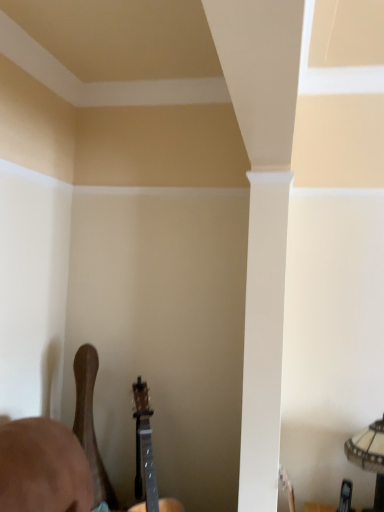
The width and height of the screenshot is (384, 512). What do you see at coordinates (370, 457) in the screenshot?
I see `glass textured lampshade at lower right` at bounding box center [370, 457].

You are a GUI agent. You are given a task and a screenshot of the screen. Output one action in this format:
    pyautogui.click(x=<x>, y=<y>)
    Task: Click on the wooden acoustic guitar at lower center, acting as the first guitar starting from the right
    
    Given the screenshot: What is the action you would take?
    pyautogui.click(x=147, y=457)

Identify the location of glass textured lampshade at lower right. Image resolution: width=384 pixels, height=512 pixels. (370, 457).

How distant is glass textured lampshade at lower right from wooden acoustic guitar at lower left, the 1th guitar when ordered from left to right?

glass textured lampshade at lower right is 4.02 feet away from wooden acoustic guitar at lower left, the 1th guitar when ordered from left to right.

Can you tell me how much glass textured lampshade at lower right and wooden acoustic guitar at lower left, arranged as the second guitar when viewed from the right, differ in facing direction?

The facing directions of glass textured lampshade at lower right and wooden acoustic guitar at lower left, arranged as the second guitar when viewed from the right, are 90.4 degrees apart.

Which of these two, glass textured lampshade at lower right or wooden acoustic guitar at lower left, arranged as the second guitar when viewed from the right, is smaller?

glass textured lampshade at lower right.

In terms of height, does glass textured lampshade at lower right look taller or shorter compared to wooden acoustic guitar at lower left, the 1th guitar when ordered from left to right?

Clearly, glass textured lampshade at lower right is shorter compared to wooden acoustic guitar at lower left, the 1th guitar when ordered from left to right.

Is wooden acoustic guitar at lower left, the 1th guitar when ordered from left to right, oriented towards wooden acoustic guitar at lower center, which is the 2th guitar from left to right?

Yes, wooden acoustic guitar at lower left, the 1th guitar when ordered from left to right, is turned towards wooden acoustic guitar at lower center, which is the 2th guitar from left to right.

Between wooden acoustic guitar at lower left, the 1th guitar when ordered from left to right, and wooden acoustic guitar at lower center, which is the 2th guitar from left to right, which one is positioned behind?

wooden acoustic guitar at lower left, the 1th guitar when ordered from left to right, is further away from the camera.

Between point (102, 501) and point (144, 506), which one is positioned behind?

The point (144, 506) is behind.

From the image's perspective, between wooden acoustic guitar at lower left, arranged as the second guitar when viewed from the right, and wooden acoustic guitar at lower center, which is the 2th guitar from left to right, who is located below?

wooden acoustic guitar at lower center, which is the 2th guitar from left to right.

Locate an element on the screen. The height and width of the screenshot is (512, 384). lamp in front of the wooden acoustic guitar at lower left, the 1th guitar when ordered from left to right is located at coordinates (370, 457).

From the image's perspective, is wooden acoustic guitar at lower left, arranged as the second guitar when viewed from the right, on top of glass textured lampshade at lower right?

Yes, from the image's perspective, wooden acoustic guitar at lower left, arranged as the second guitar when viewed from the right, is above glass textured lampshade at lower right.

Is wooden acoustic guitar at lower left, arranged as the second guitar when viewed from the right, positioned with its back to glass textured lampshade at lower right?

That's not correct — wooden acoustic guitar at lower left, arranged as the second guitar when viewed from the right, is not looking away from glass textured lampshade at lower right.

Which object is further away from the camera taking this photo, wooden acoustic guitar at lower left, arranged as the second guitar when viewed from the right, or glass textured lampshade at lower right?

Positioned behind is wooden acoustic guitar at lower left, arranged as the second guitar when viewed from the right.

Consider the image. Is wooden acoustic guitar at lower center, which is the 2th guitar from left to right, oriented towards glass textured lampshade at lower right?

Yes, wooden acoustic guitar at lower center, which is the 2th guitar from left to right, faces towards glass textured lampshade at lower right.

Is wooden acoustic guitar at lower center, acting as the first guitar starting from the right, placed right next to glass textured lampshade at lower right?

They are not placed beside each other.

Locate an element on the screen. The height and width of the screenshot is (512, 384). lamp in front of the wooden acoustic guitar at lower center, which is the 2th guitar from left to right is located at coordinates (370, 457).

Considering the sizes of objects wooden acoustic guitar at lower center, which is the 2th guitar from left to right, and glass textured lampshade at lower right in the image provided, who is thinner, wooden acoustic guitar at lower center, which is the 2th guitar from left to right, or glass textured lampshade at lower right?

glass textured lampshade at lower right is thinner.

Between wooden acoustic guitar at lower center, which is the 2th guitar from left to right, and wooden acoustic guitar at lower left, the 1th guitar when ordered from left to right, which one has larger width?

wooden acoustic guitar at lower center, which is the 2th guitar from left to right.

Is wooden acoustic guitar at lower left, arranged as the second guitar when viewed from the right, a part of wooden acoustic guitar at lower center, acting as the first guitar starting from the right?

No, wooden acoustic guitar at lower left, arranged as the second guitar when viewed from the right, is not surrounded by wooden acoustic guitar at lower center, acting as the first guitar starting from the right.

Considering the sizes of wooden acoustic guitar at lower center, which is the 2th guitar from left to right, and wooden acoustic guitar at lower left, the 1th guitar when ordered from left to right, in the image, is wooden acoustic guitar at lower center, which is the 2th guitar from left to right, bigger or smaller than wooden acoustic guitar at lower left, the 1th guitar when ordered from left to right,?

Considering their sizes, wooden acoustic guitar at lower center, which is the 2th guitar from left to right, takes up more space than wooden acoustic guitar at lower left, the 1th guitar when ordered from left to right.

Considering the sizes of objects glass textured lampshade at lower right and wooden acoustic guitar at lower center, which is the 2th guitar from left to right, in the image provided, who is taller, glass textured lampshade at lower right or wooden acoustic guitar at lower center, which is the 2th guitar from left to right,?

With more height is wooden acoustic guitar at lower center, which is the 2th guitar from left to right.

Is glass textured lampshade at lower right thinner than wooden acoustic guitar at lower center, which is the 2th guitar from left to right?

Yes, glass textured lampshade at lower right is thinner than wooden acoustic guitar at lower center, which is the 2th guitar from left to right.

Measure the distance between glass textured lampshade at lower right and wooden acoustic guitar at lower center, which is the 2th guitar from left to right.

glass textured lampshade at lower right and wooden acoustic guitar at lower center, which is the 2th guitar from left to right, are 38.08 inches apart from each other.

Can wooden acoustic guitar at lower center, which is the 2th guitar from left to right, be found inside glass textured lampshade at lower right?

Actually, wooden acoustic guitar at lower center, which is the 2th guitar from left to right, is outside glass textured lampshade at lower right.

Where is `lamp that appears on the right of wooden acoustic guitar at lower left, the 1th guitar when ordered from left to right`? The image size is (384, 512). lamp that appears on the right of wooden acoustic guitar at lower left, the 1th guitar when ordered from left to right is located at coordinates (370, 457).

Locate an element on the screen. The image size is (384, 512). guitar on the left of wooden acoustic guitar at lower center, acting as the first guitar starting from the right is located at coordinates (90, 423).

Estimate the real-world distances between objects in this image. Which object is further from wooden acoustic guitar at lower left, the 1th guitar when ordered from left to right, glass textured lampshade at lower right or wooden acoustic guitar at lower center, which is the 2th guitar from left to right?

glass textured lampshade at lower right lies further to wooden acoustic guitar at lower left, the 1th guitar when ordered from left to right, than the other object.

Estimate the real-world distances between objects in this image. Which object is further from wooden acoustic guitar at lower left, the 1th guitar when ordered from left to right, wooden acoustic guitar at lower center, acting as the first guitar starting from the right, or glass textured lampshade at lower right?

Among the two, glass textured lampshade at lower right is located further to wooden acoustic guitar at lower left, the 1th guitar when ordered from left to right.

Which object lies further to the anchor point wooden acoustic guitar at lower center, acting as the first guitar starting from the right, wooden acoustic guitar at lower left, arranged as the second guitar when viewed from the right, or glass textured lampshade at lower right?

glass textured lampshade at lower right is further to wooden acoustic guitar at lower center, acting as the first guitar starting from the right.

Which object lies further to the anchor point wooden acoustic guitar at lower center, acting as the first guitar starting from the right, glass textured lampshade at lower right or wooden acoustic guitar at lower left, the 1th guitar when ordered from left to right?

Based on the image, glass textured lampshade at lower right appears to be further to wooden acoustic guitar at lower center, acting as the first guitar starting from the right.

Considering their positions, is wooden acoustic guitar at lower left, the 1th guitar when ordered from left to right, positioned further to glass textured lampshade at lower right than wooden acoustic guitar at lower center, which is the 2th guitar from left to right?

wooden acoustic guitar at lower left, the 1th guitar when ordered from left to right, is further to glass textured lampshade at lower right.

Based on their spatial positions, is wooden acoustic guitar at lower center, which is the 2th guitar from left to right, or wooden acoustic guitar at lower left, the 1th guitar when ordered from left to right, further from glass textured lampshade at lower right?

wooden acoustic guitar at lower left, the 1th guitar when ordered from left to right, lies further to glass textured lampshade at lower right than the other object.

Find the location of a particular element. The width and height of the screenshot is (384, 512). guitar between wooden acoustic guitar at lower left, the 1th guitar when ordered from left to right, and glass textured lampshade at lower right is located at coordinates (147, 457).